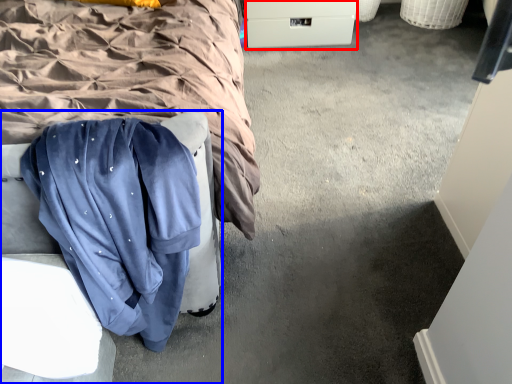
Question: Among these objects, which one is nearest to the camera, drawer (highlighted by a red box) or furniture (highlighted by a blue box)?

Choices:
 (A) drawer
 (B) furniture

Answer: (B)